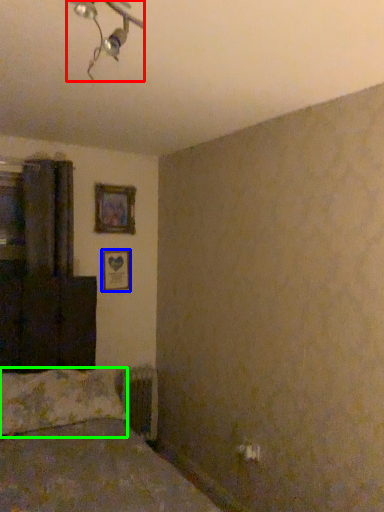
Question: Which object is the farthest from light fixture (highlighted by a red box)? Choose among these: picture frame (highlighted by a blue box) or pillow (highlighted by a green box).

Choices:
 (A) picture frame
 (B) pillow

Answer: (A)